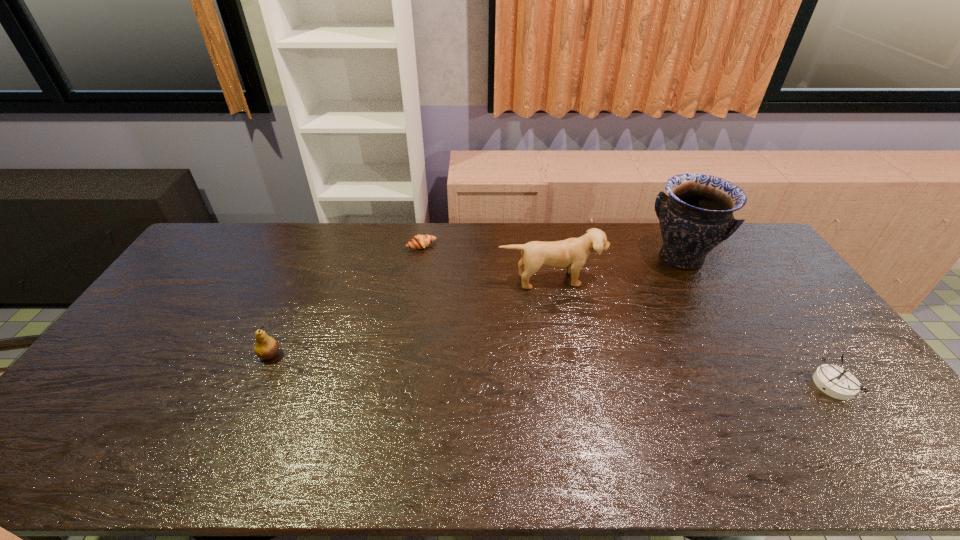
The height and width of the screenshot is (540, 960). I want to click on free space located on the front-facing side of the fourth object from right to left, so tap(446, 276).

Image resolution: width=960 pixels, height=540 pixels. Identify the location of pottery situated at the far edge. (697, 215).

Where is `pastry at the far edge`? This screenshot has width=960, height=540. pastry at the far edge is located at coordinates (419, 241).

Locate an element on the screen. This screenshot has height=540, width=960. object present at the near edge is located at coordinates (833, 380).

Where is `object present at the right edge`? object present at the right edge is located at coordinates (833, 380).

This screenshot has height=540, width=960. In order to click on object located in the near right corner section of the desktop in this screenshot , I will do point(833,380).

Where is `free region at the far edge of the desktop`? The height and width of the screenshot is (540, 960). free region at the far edge of the desktop is located at coordinates (499, 259).

The height and width of the screenshot is (540, 960). In order to click on free space at the near edge of the desktop in this screenshot , I will do `click(660, 427)`.

Find the location of a particular element. free space at the far left corner of the desktop is located at coordinates (252, 227).

Where is `free space at the near right corner`? free space at the near right corner is located at coordinates (888, 416).